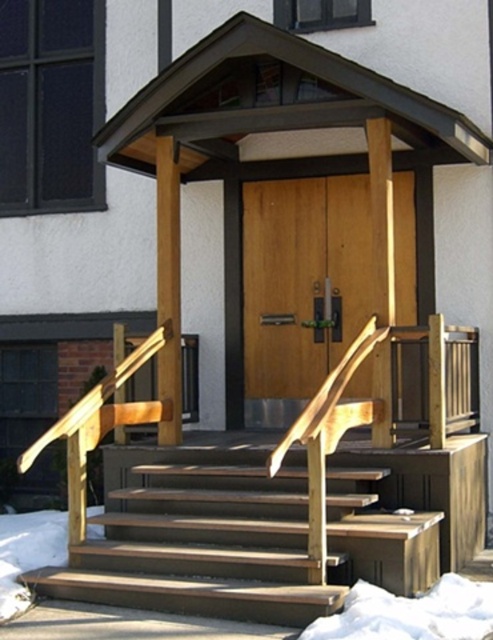
In the scene shown: You are standing at the bottom of the wooden stairs at center and want to walk to the wooden at center. In which direction should you move?

The wooden stairs at center is to the left of wooden at center, so you should move to the right to reach the wooden at center.

You are a delivery person carrying a large package and need to place it on the brown wood porch at center. The wooden stairs at center lead up to the porch. Can you determine if the porch is wide enough to accommodate the package without overhanging the stairs?

The brown wood porch at center might be wider than wooden stairs at center, so there is a possibility that the porch can accommodate the package without overhanging the stairs, but the exact width isn